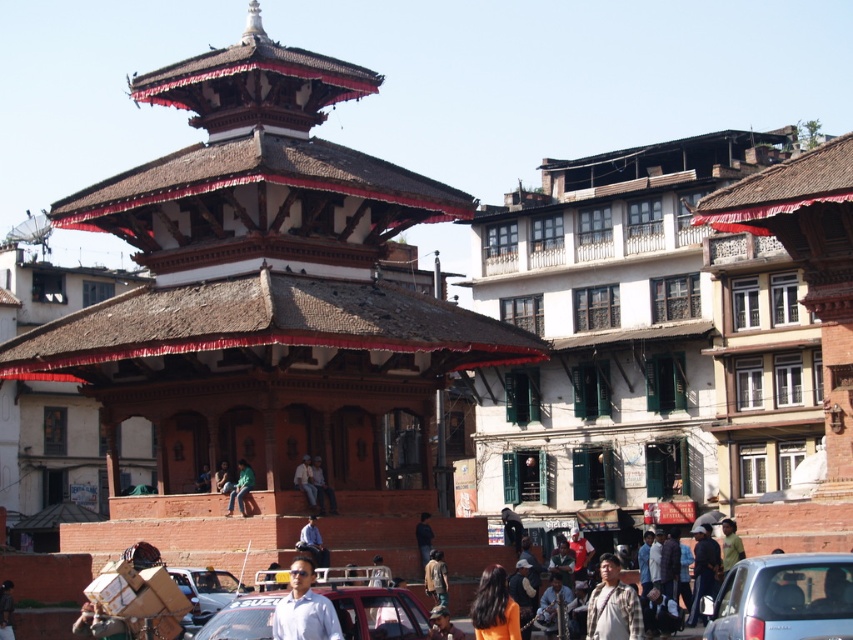
You are a delivery person who needs to place a package on the raised platform near the temple. You have a metallic silver car at lower right and a light brown leather jacket at center. Which object is closer to the raised platform where you need to deliver the package?

The light brown leather jacket at center is closer to the raised platform than the metallic silver car at lower right because they are 22.55 meters apart.

You are a photographer planning to capture the temple structure in the background while also including both the metallic silver car at lower right and the green fabric pants at center in the frame. Given their sizes, which object would you need to position closer to the camera to ensure both fit well in the photo?

The metallic silver car at lower right is bigger than the green fabric pants at center. To ensure both fit well in the photo, you should position the metallic silver car at lower right closer to the camera so its larger size doesn not overwhelm the frame, while keeping the green fabric pants at center at a distance to maintain balance.

You are a photographer standing at the edge of the platform in front of the temple structure. You want to take a photo that includes both the green fabric pants at center and the light brown leather jacket at center. Given that your camera has a maximum focus range of 8 feet, will you be able to capture both subjects in focus without moving your position?

The green fabric pants at center and light brown leather jacket at center are 8.87 feet apart. Since the distance between them exceeds the camera maximum focus range of 8 feet, you will not be able to capture both subjects in focus without moving your position.